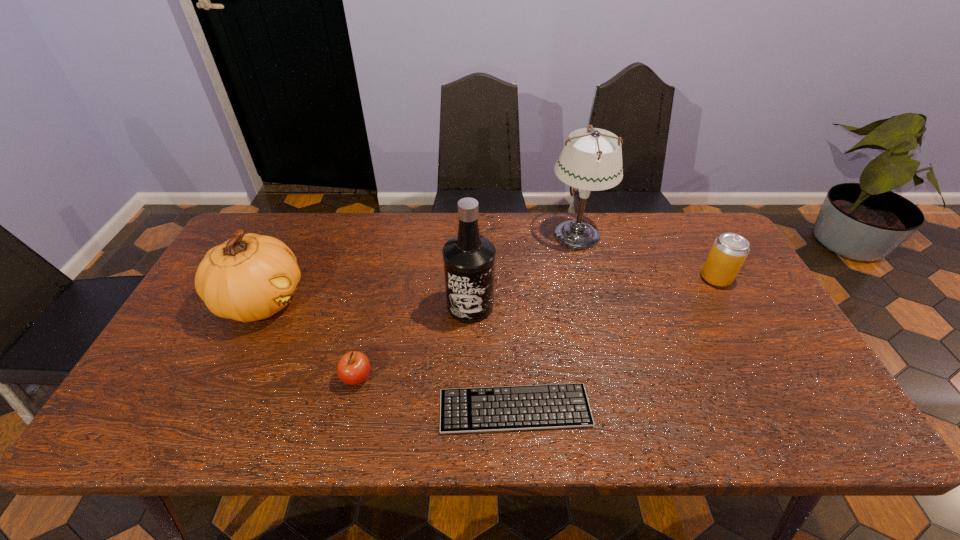
This screenshot has width=960, height=540. Identify the location of blank area located 0.180m on the lampshade of the lampshade. (492, 234).

Identify the location of free space located 0.270m on the lampshade of the lampshade. This screenshot has width=960, height=540. (465, 234).

Locate an element on the screen. The width and height of the screenshot is (960, 540). free space located on the front label of the liquor is located at coordinates (468, 426).

You are a GUI agent. You are given a task and a screenshot of the screen. Output one action in this format:
    pyautogui.click(x=<x>, y=<y>)
    Task: Click on the vacant region located on the front face of the leftmost object
    The width and height of the screenshot is (960, 540).
    Given the screenshot: What is the action you would take?
    pyautogui.click(x=410, y=301)

Where is `vacant space positioned on the back of the pop (soda)`? This screenshot has height=540, width=960. vacant space positioned on the back of the pop (soda) is located at coordinates (687, 226).

At what (x,y) coordinates should I click in order to perform the action: click on free location located 0.070m on the left of the second object from left to right. Please return your answer as a coordinate pair (x, y). Image resolution: width=960 pixels, height=540 pixels. Looking at the image, I should click on (312, 378).

At what (x,y) coordinates should I click in order to perform the action: click on vacant space located on the back of the computer keyboard. Please return your answer as a coordinate pair (x, y). This screenshot has height=540, width=960. Looking at the image, I should click on (510, 335).

You are a GUI agent. You are given a task and a screenshot of the screen. Output one action in this format:
    pyautogui.click(x=<x>, y=<y>)
    Task: Click on the object located in the far edge section of the desktop
    Image resolution: width=960 pixels, height=540 pixels.
    Given the screenshot: What is the action you would take?
    pyautogui.click(x=592, y=161)

At what (x,y) coordinates should I click in order to perform the action: click on object that is at the near edge. Please return your answer as a coordinate pair (x, y). This screenshot has height=540, width=960. Looking at the image, I should click on (505, 408).

The width and height of the screenshot is (960, 540). In order to click on object present at the left edge in this screenshot , I will do `click(250, 277)`.